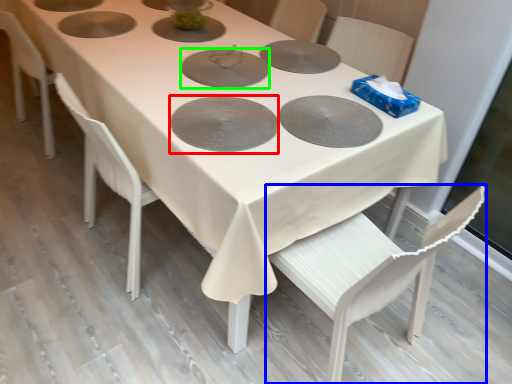
Question: Considering the real-world distances, which object is closest to pizza pan (highlighted by a red box)? chair (highlighted by a blue box) or pizza pan (highlighted by a green box).

Choices:
 (A) chair
 (B) pizza pan

Answer: (B)